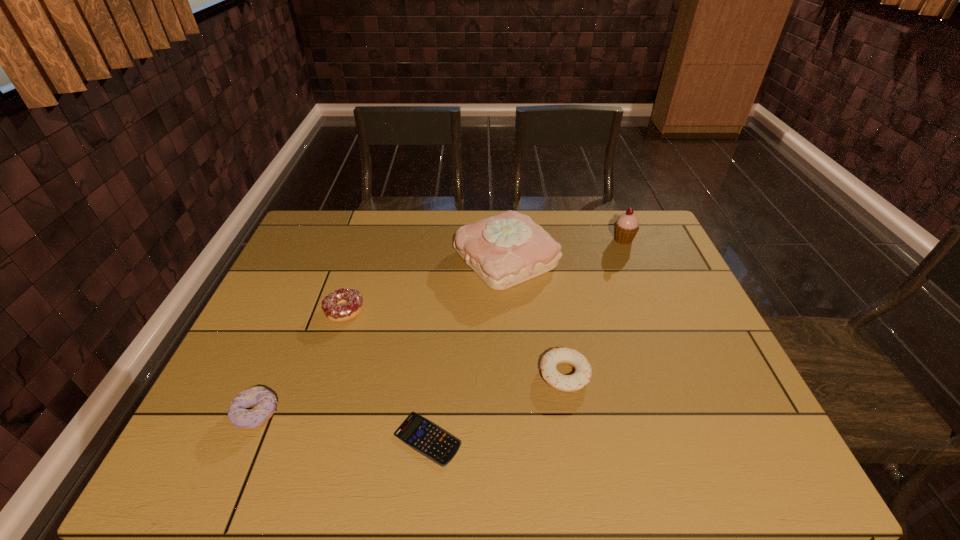
Image resolution: width=960 pixels, height=540 pixels. Identify the location of the rightmost object. (626, 226).

Find the location of `cake`. cake is located at coordinates (504, 250).

Where is `the second doughnut from right to left`? The height and width of the screenshot is (540, 960). the second doughnut from right to left is located at coordinates (352, 299).

Locate an element on the screen. The width and height of the screenshot is (960, 540). the fifth object from right to left is located at coordinates (352, 299).

Where is `the leftmost doughnut`? Image resolution: width=960 pixels, height=540 pixels. the leftmost doughnut is located at coordinates (x=238, y=414).

Where is `the rightmost doughnut`? the rightmost doughnut is located at coordinates click(x=566, y=383).

Where is `the shortest object`? Image resolution: width=960 pixels, height=540 pixels. the shortest object is located at coordinates (422, 435).

Identify the location of vacant space located 0.070m on the front of the rightmost object. (632, 261).

The height and width of the screenshot is (540, 960). What are the coordinates of `free location located 0.300m on the front of the cake` in the screenshot? It's located at (515, 382).

The width and height of the screenshot is (960, 540). I want to click on blank space located on the back of the third farthest object, so click(355, 276).